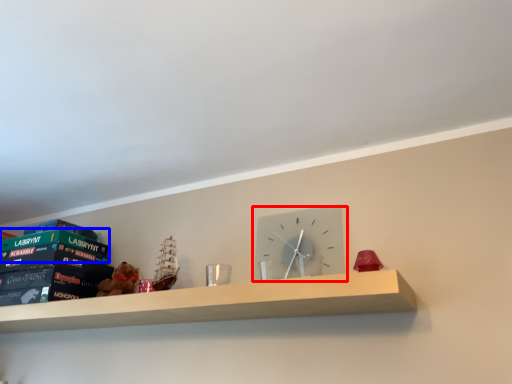
Question: Which object is closer to the camera taking this photo, wall clock (highlighted by a red box) or paperback book (highlighted by a blue box)?

Choices:
 (A) wall clock
 (B) paperback book

Answer: (A)